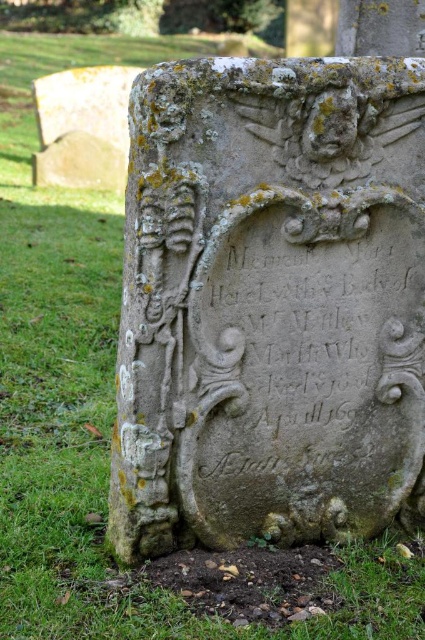
Question: Considering the relative positions of carved stone gravestone at center and carved stone inscription at center in the image provided, where is carved stone gravestone at center located with respect to carved stone inscription at center?

Choices:
 (A) right
 (B) left

Answer: (B)

Question: Does carved stone gravestone at center appear on the right side of carved stone inscription at center?

Choices:
 (A) no
 (B) yes

Answer: (A)

Question: Which point is closer to the camera?

Choices:
 (A) carved stone gravestone at center
 (B) carved stone inscription at center

Answer: (A)

Question: Can you confirm if carved stone gravestone at center is positioned below carved stone inscription at center?

Choices:
 (A) no
 (B) yes

Answer: (A)

Question: Which point is farther to the camera?

Choices:
 (A) carved stone gravestone at center
 (B) carved stone inscription at center

Answer: (B)